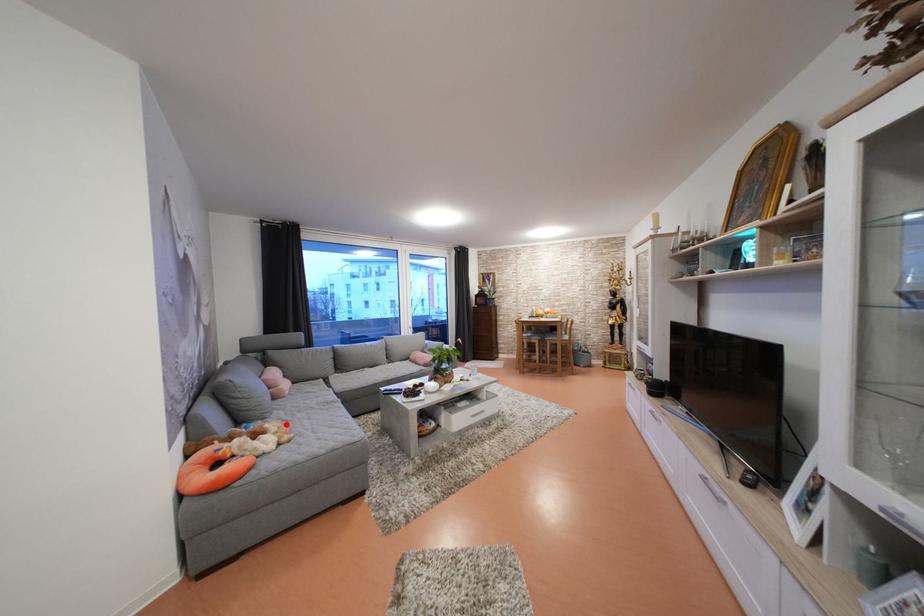
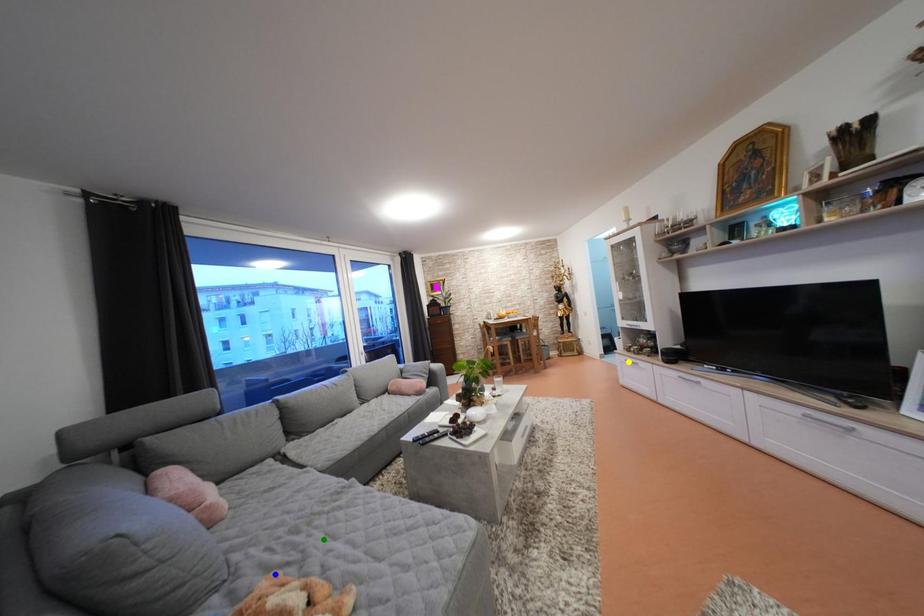
Question: I am providing you with two images of the same scene from different viewpoints. A red point is marked on the first image. You are given multiple points on the second image. Which point in image 2 is actually the same real-world point as the red point in image 1?

Choices:
 (A) green point
 (B) yellow point
 (C) blue point

Answer: (C)